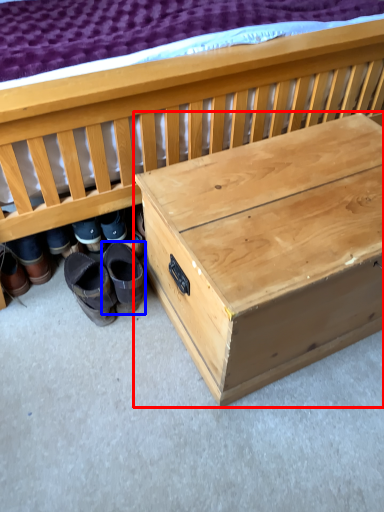
Question: Which point is further to the camera, table (highlighted by a red box) or footwear (highlighted by a blue box)?

Choices:
 (A) table
 (B) footwear

Answer: (B)